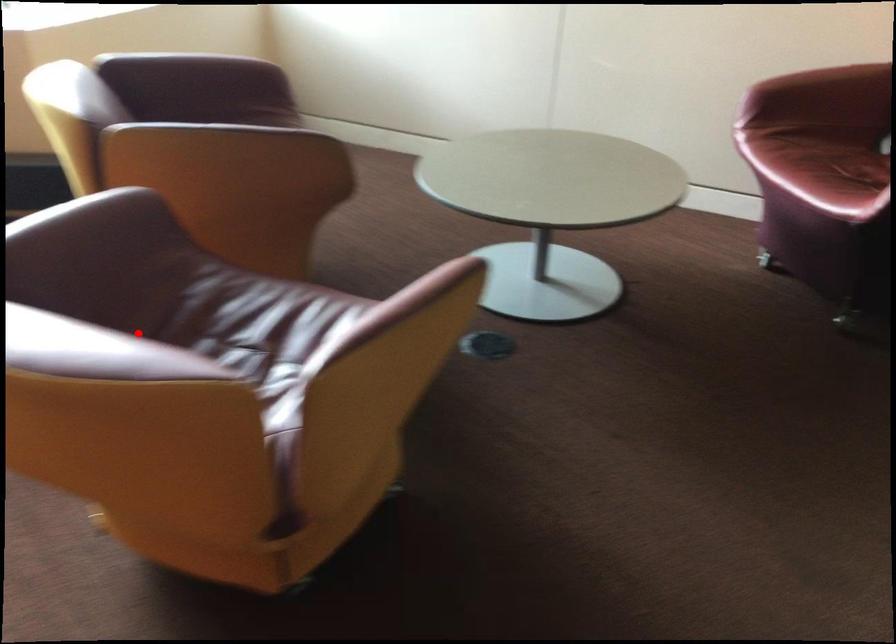
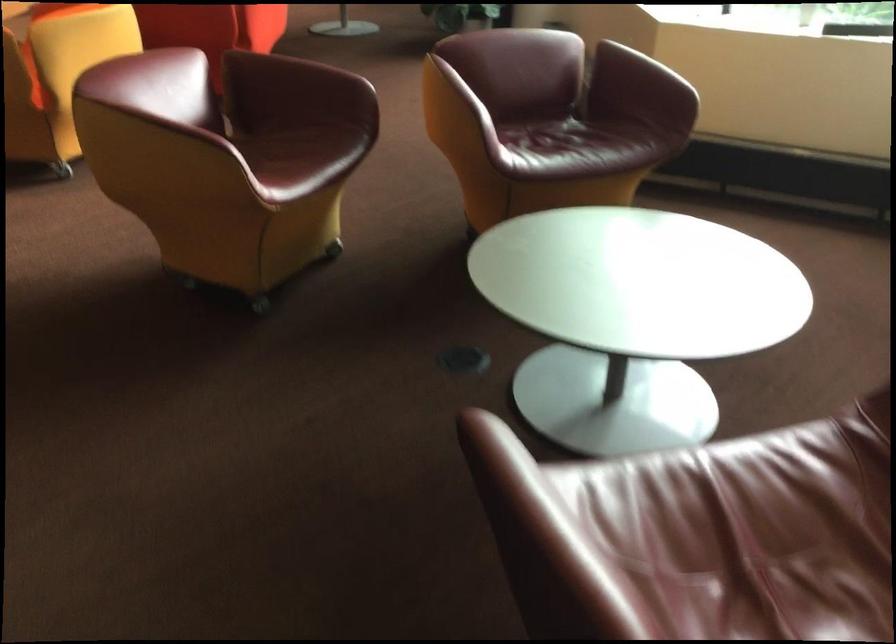
Find the pixel in the second image that matches the highlighted location in the first image.

(289, 146)